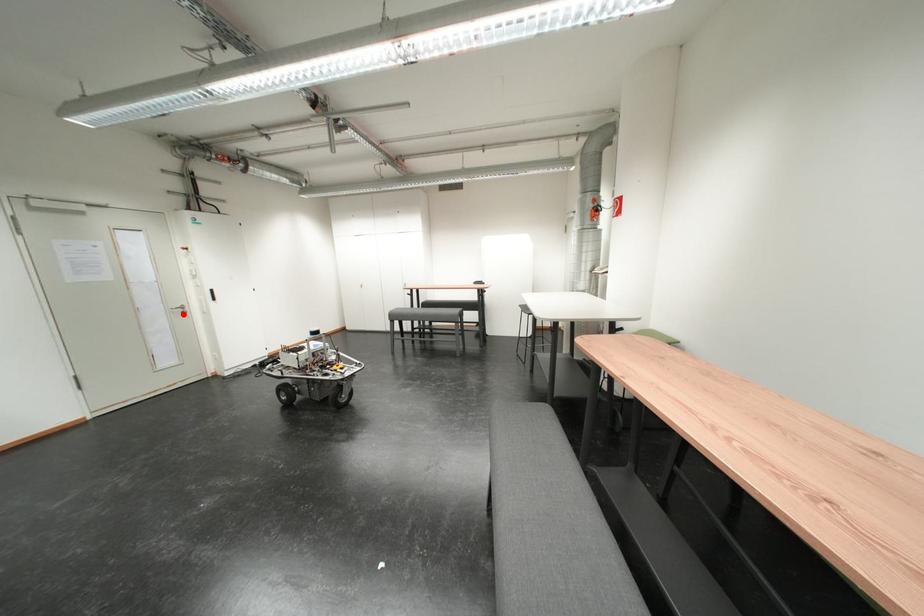
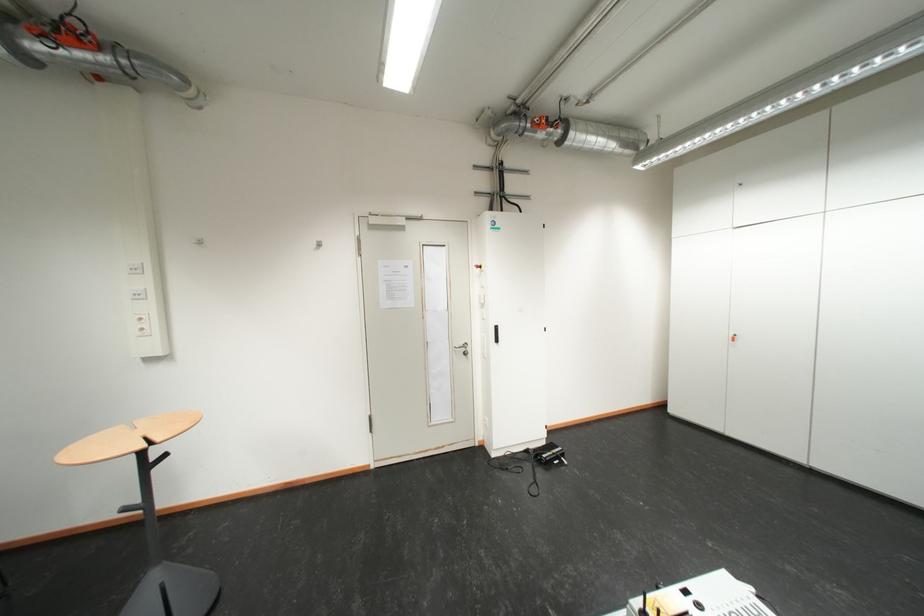
Find the pixel in the second image that matches the highlighted location in the first image.

(466, 353)